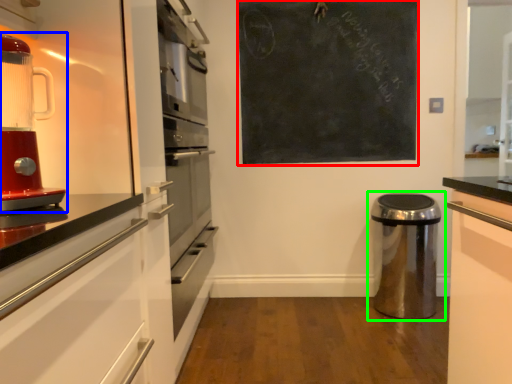
Question: Based on their relative distances, which object is farther from bulletin board (highlighted by a red box)? Choose from home appliance (highlighted by a blue box) and waste container (highlighted by a green box).

Choices:
 (A) home appliance
 (B) waste container

Answer: (A)